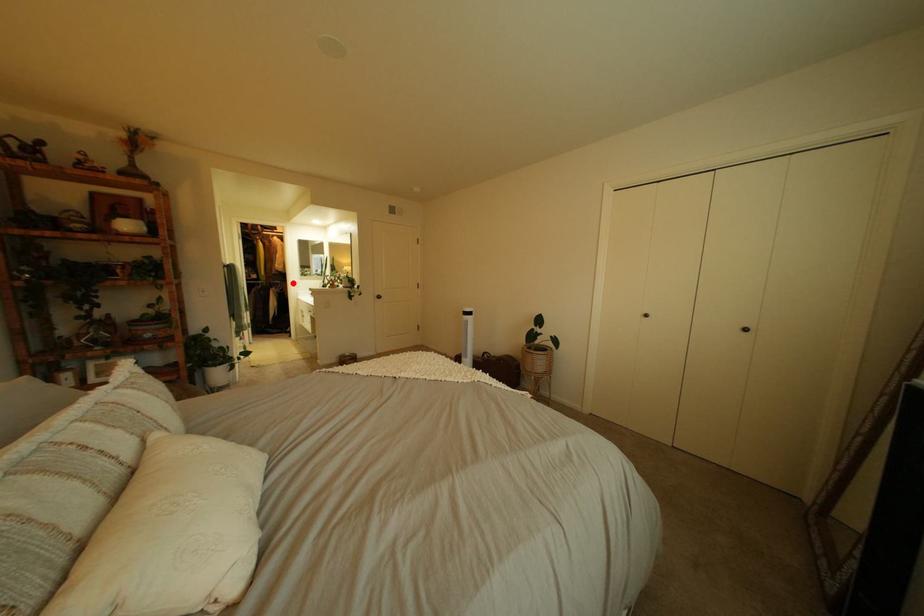
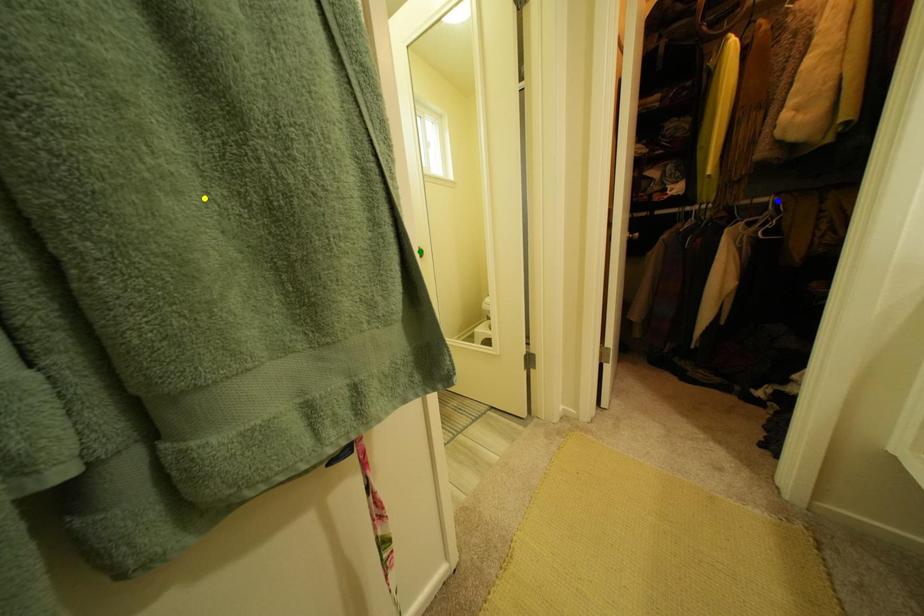
Question: I am providing you with two images of the same scene from different viewpoints. A red point is marked on the first image. You are given multiple points on the second image. Which mark in image 2 goes with the point in image 1?

Choices:
 (A) green point
 (B) yellow point
 (C) blue point

Answer: (C)